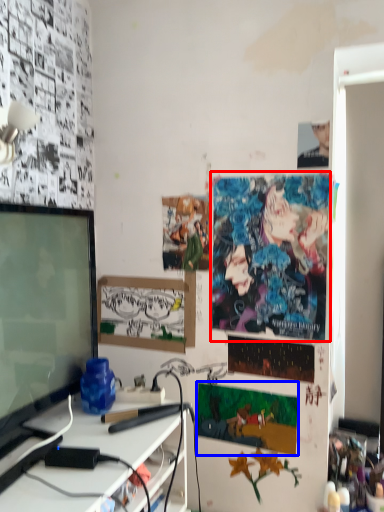
Question: Which of the following is the farthest to the observer, poster page (highlighted by a red box) or poster page (highlighted by a blue box)?

Choices:
 (A) poster page
 (B) poster page

Answer: (B)